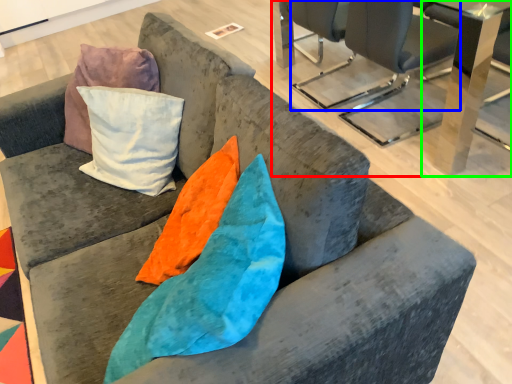
Question: Estimate the real-world distances between objects in this image. Which object is closer to table (highlighted by a red box), chair (highlighted by a blue box) or table (highlighted by a green box)?

Choices:
 (A) chair
 (B) table

Answer: (B)